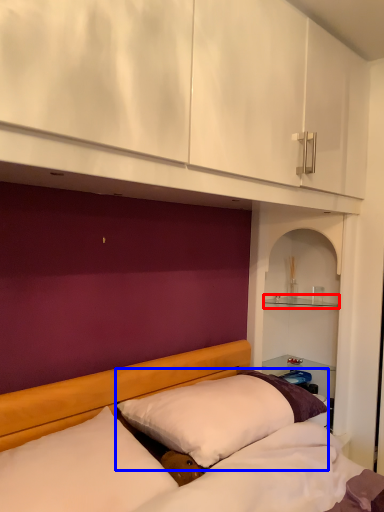
Question: Which of the following is the farthest to the observer, shelf (highlighted by a red box) or pillow (highlighted by a blue box)?

Choices:
 (A) shelf
 (B) pillow

Answer: (A)